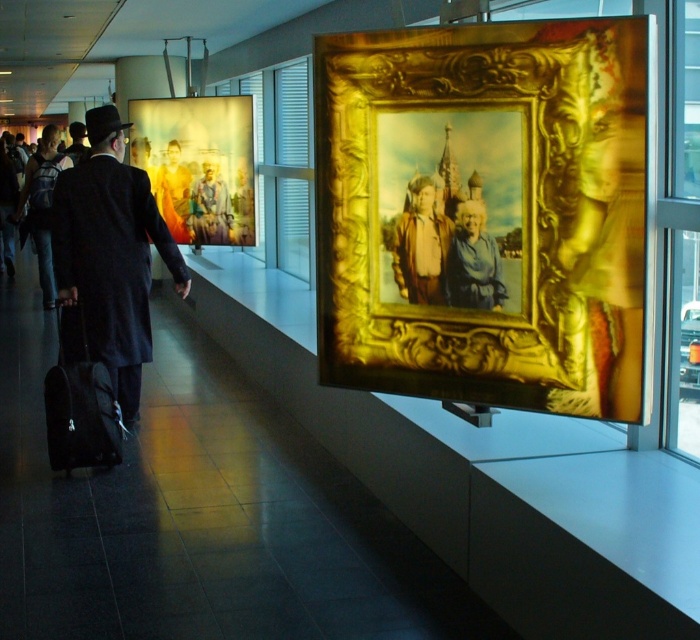
Can you confirm if gold ornate frame at upper center is positioned to the right of brown leather jacket at center?

Indeed, gold ornate frame at upper center is positioned on the right side of brown leather jacket at center.

The image size is (700, 640). Describe the element at coordinates (484, 212) in the screenshot. I see `gold ornate frame at upper center` at that location.

Describe the element at coordinates (484, 212) in the screenshot. This screenshot has width=700, height=640. I see `gold ornate frame at upper center` at that location.

This screenshot has height=640, width=700. I want to click on gold ornate frame at upper center, so click(x=484, y=212).

The width and height of the screenshot is (700, 640). What do you see at coordinates (197, 164) in the screenshot?
I see `matte gold picture frame at center` at bounding box center [197, 164].

The height and width of the screenshot is (640, 700). Find the location of `matte gold picture frame at center`. matte gold picture frame at center is located at coordinates (197, 164).

What do you see at coordinates (197, 164) in the screenshot?
I see `matte gold picture frame at center` at bounding box center [197, 164].

Where is `matte gold picture frame at center`? matte gold picture frame at center is located at coordinates (197, 164).

Who is lower down, gold ornate frame at upper center or black wool coat at center?

black wool coat at center is below.

Who is more distant from viewer, (398,388) or (91,115)?

The point (91,115) is more distant.

Locate an element on the screen. gold ornate frame at upper center is located at coordinates (484, 212).